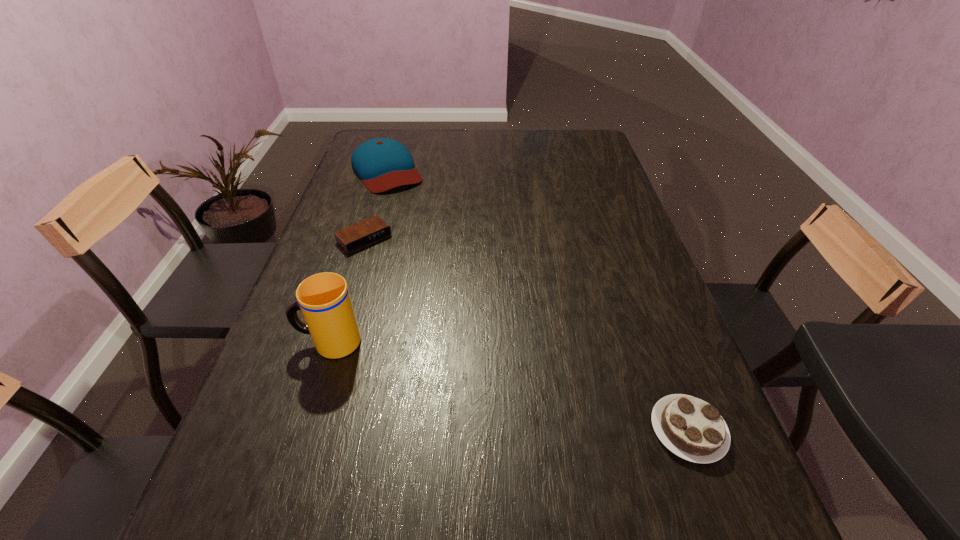
The height and width of the screenshot is (540, 960). Find the location of `vacant space on the desktop that is between the cup and the chocolate cake and is positioned on the front face of the third nearest object`. vacant space on the desktop that is between the cup and the chocolate cake and is positioned on the front face of the third nearest object is located at coordinates (515, 388).

Image resolution: width=960 pixels, height=540 pixels. Find the location of `free space on the desktop that is between the tallest object and the chocolate cake and is positioned with the bill of the third shortest object facing forward`. free space on the desktop that is between the tallest object and the chocolate cake and is positioned with the bill of the third shortest object facing forward is located at coordinates (540, 394).